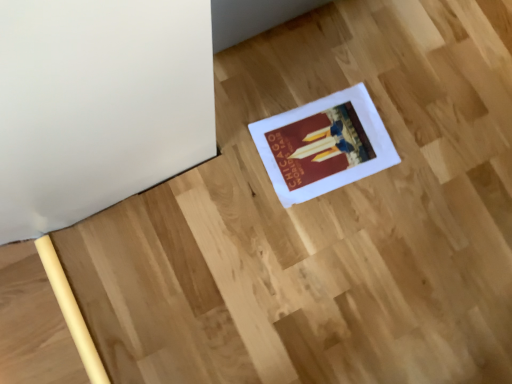
Locate an element on the screen. Image resolution: width=512 pixels, height=384 pixels. free location above white matte picture frame at center (from a real-world perspective) is located at coordinates (325, 143).